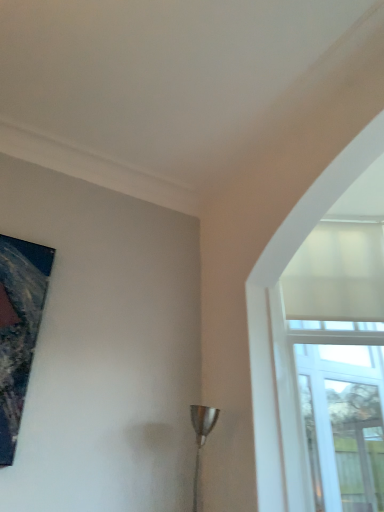
Question: Is metallic silver lamp at lower center smaller than white matte glass window at upper right?

Choices:
 (A) yes
 (B) no

Answer: (A)

Question: Is metallic silver lamp at lower center not near white matte glass window at upper right?

Choices:
 (A) no
 (B) yes

Answer: (A)

Question: Is metallic silver lamp at lower center facing towards white matte glass window at upper right?

Choices:
 (A) yes
 (B) no

Answer: (B)

Question: Is white matte glass window at upper right at the back of metallic silver lamp at lower center?

Choices:
 (A) yes
 (B) no

Answer: (B)

Question: Is metallic silver lamp at lower center wider than white matte glass window at upper right?

Choices:
 (A) yes
 (B) no

Answer: (A)

Question: From a real-world perspective, relative to metallic silver lamp at lower center, is white matte glass window at upper right vertically above or below?

Choices:
 (A) above
 (B) below

Answer: (A)

Question: Is point (309, 190) positioned closer to the camera than point (208, 429)?

Choices:
 (A) farther
 (B) closer

Answer: (A)

Question: Considering the relative positions of white matte glass window at upper right and metallic silver lamp at lower center in the image provided, is white matte glass window at upper right to the left or to the right of metallic silver lamp at lower center?

Choices:
 (A) right
 (B) left

Answer: (A)

Question: Looking at the image, does white matte glass window at upper right seem bigger or smaller compared to metallic silver lamp at lower center?

Choices:
 (A) big
 (B) small

Answer: (A)

Question: Does point (324, 168) appear closer or farther from the camera than point (0, 307)?

Choices:
 (A) farther
 (B) closer

Answer: (A)

Question: Considering the positions of white matte glass window at upper right and metallic painting at upper left in the image, is white matte glass window at upper right taller or shorter than metallic painting at upper left?

Choices:
 (A) tall
 (B) short

Answer: (A)

Question: Is white matte glass window at upper right in front of or behind metallic painting at upper left in the image?

Choices:
 (A) behind
 (B) front

Answer: (A)

Question: From a real-world perspective, is white matte glass window at upper right physically located above or below metallic painting at upper left?

Choices:
 (A) below
 (B) above

Answer: (B)

Question: From a real-world perspective, is metallic silver lamp at lower center positioned above or below white matte glass window at upper right?

Choices:
 (A) below
 (B) above

Answer: (A)

Question: Is metallic silver lamp at lower center spatially inside white matte glass window at upper right, or outside of it?

Choices:
 (A) inside
 (B) outside

Answer: (B)